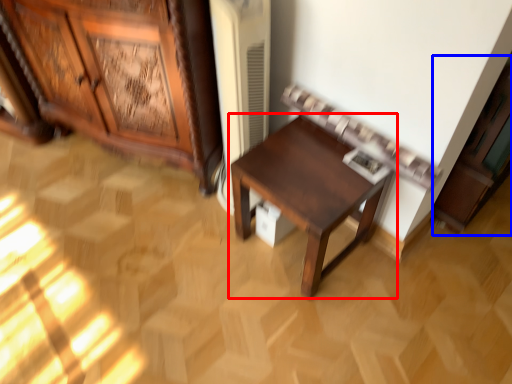
Question: Among these objects, which one is nearest to the camera, table (highlighted by a red box) or cabinetry (highlighted by a blue box)?

Choices:
 (A) table
 (B) cabinetry

Answer: (B)